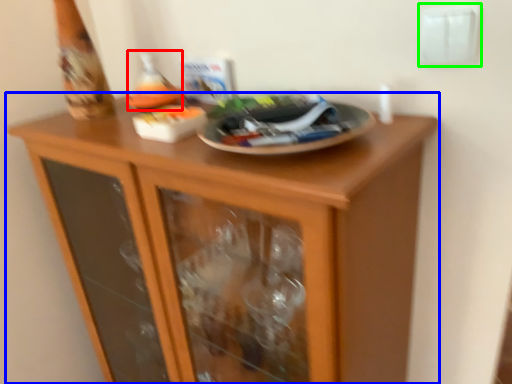
Question: Estimate the real-world distances between objects in this image. Which object is farther from wine bottle (highlighted by a red box), cupboard (highlighted by a blue box) or electric outlet (highlighted by a green box)?

Choices:
 (A) cupboard
 (B) electric outlet

Answer: (B)